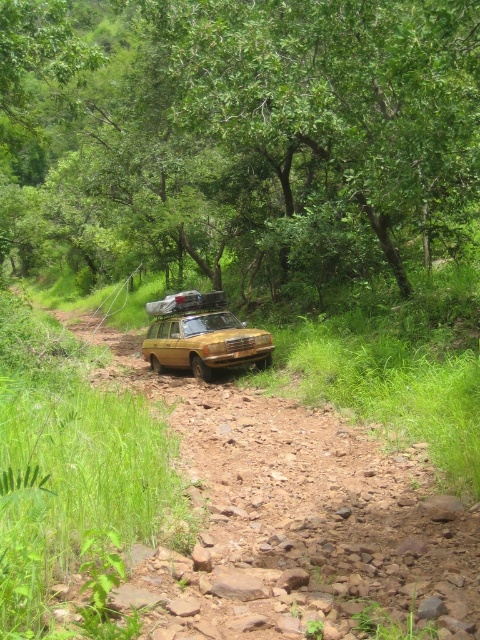
Question: Considering the relative positions of brown rocky dirt track at center and rusty metallic station wagon at center in the image provided, where is brown rocky dirt track at center located with respect to rusty metallic station wagon at center?

Choices:
 (A) right
 (B) left

Answer: (A)

Question: Estimate the real-world distances between objects in this image. Which object is farther from the green leafy tree at center?

Choices:
 (A) matte yellow jeep at center
 (B) brown rocky dirt track at center

Answer: (B)

Question: Is brown rocky dirt track at center above rusty metallic station wagon at center?

Choices:
 (A) yes
 (B) no

Answer: (B)

Question: Which object is positioned closest to the matte yellow jeep at center?

Choices:
 (A) rusty metallic station wagon at center
 (B) brown rocky dirt track at center

Answer: (A)

Question: Is rusty metallic station wagon at center positioned before matte yellow jeep at center?

Choices:
 (A) no
 (B) yes

Answer: (B)

Question: Which point is farther to the camera?

Choices:
 (A) (131, 582)
 (B) (187, 307)
 (C) (465, 100)

Answer: (B)